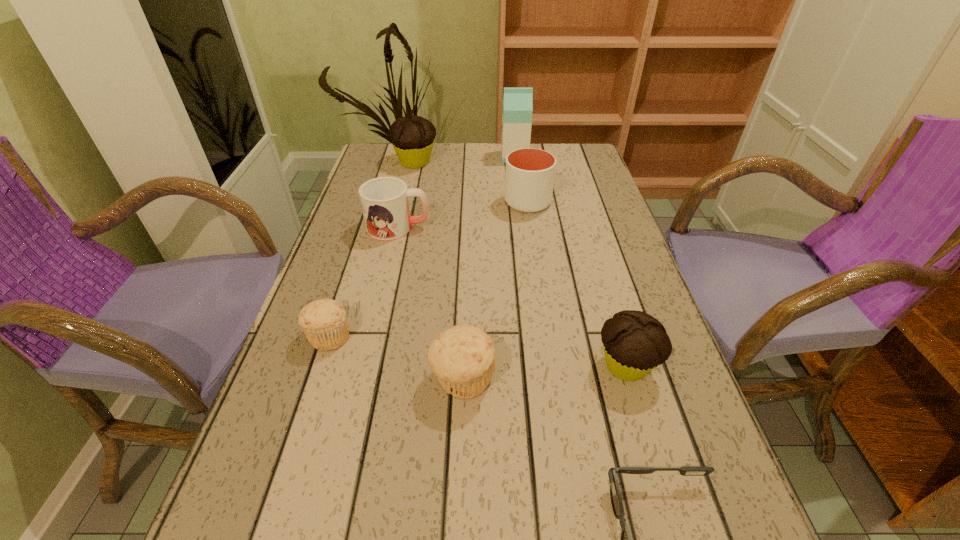
The width and height of the screenshot is (960, 540). In order to click on vacant space in between the cup and the nearer chocolate muffin in this screenshot , I will do `click(577, 284)`.

Find the location of a particular element. This screenshot has width=960, height=540. object that is the fifth nearest to the cup is located at coordinates (463, 357).

The height and width of the screenshot is (540, 960). In order to click on object that is the second nearest to the left beige muffin in this screenshot , I will do `click(384, 200)`.

Find the location of `muffin identified as the third closest to the milk carton`. muffin identified as the third closest to the milk carton is located at coordinates (324, 322).

Where is `muffin that can be found as the third closest to the shortest object`? The width and height of the screenshot is (960, 540). muffin that can be found as the third closest to the shortest object is located at coordinates (324, 322).

The height and width of the screenshot is (540, 960). In order to click on chocolate muffin identified as the second closest to the mug in this screenshot , I will do `click(634, 342)`.

Locate which chocolate muffin is the closest to the left beige muffin. Please provide its 2D coordinates. Your answer should be formatted as a tuple, i.e. [(x, y)], where the tuple contains the x and y coordinates of a point satisfying the conditions above.

[(634, 342)]

Locate an element on the screen. This screenshot has width=960, height=540. vacant region that satisfies the following two spatial constraints: 1. on the front side of the farther chocolate muffin; 2. on the left side of the cup is located at coordinates (406, 202).

Locate an element on the screen. This screenshot has height=540, width=960. vacant space that satisfies the following two spatial constraints: 1. on the side of the mug with the handle; 2. on the front side of the smaller beige muffin is located at coordinates (372, 336).